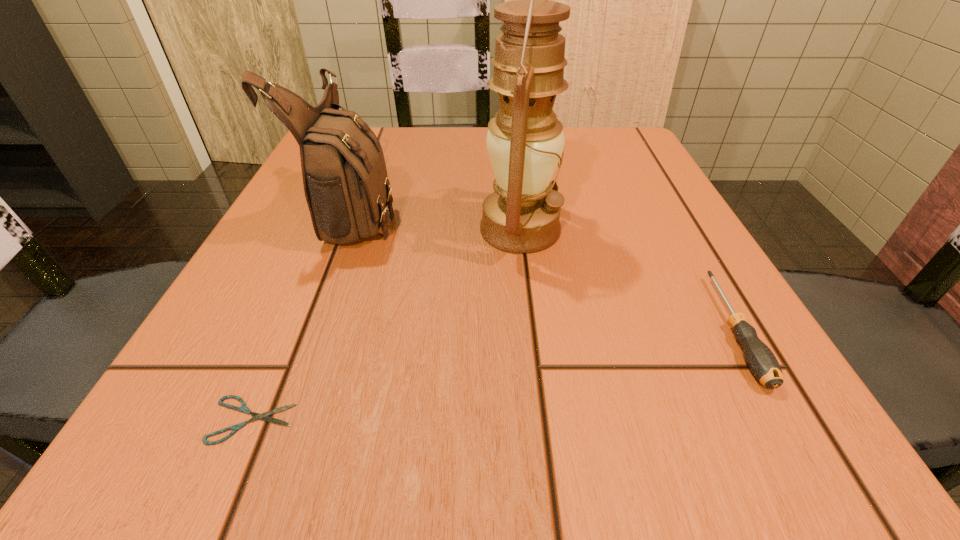
Image resolution: width=960 pixels, height=540 pixels. Find the location of `vacant area situated 0.210m on the back of the shortest object`. vacant area situated 0.210m on the back of the shortest object is located at coordinates (312, 277).

Find the location of `object present at the near edge`. object present at the near edge is located at coordinates (243, 408).

Locate an element on the screen. This screenshot has width=960, height=540. shoulder bag present at the left edge is located at coordinates (346, 186).

At what (x,y) coordinates should I click in order to perform the action: click on shears that is positioned at the left edge. Please return your answer as a coordinate pair (x, y). Looking at the image, I should click on (243, 408).

Locate an element on the screen. object situated at the right edge is located at coordinates (761, 361).

The width and height of the screenshot is (960, 540). What are the coordinates of `object at the near left corner` in the screenshot? It's located at 243,408.

Image resolution: width=960 pixels, height=540 pixels. Identify the location of free space at the far edge. (460, 142).

Image resolution: width=960 pixels, height=540 pixels. I want to click on blank space at the near edge of the desktop, so click(487, 402).

The height and width of the screenshot is (540, 960). In order to click on vacant space at the left edge of the desktop in this screenshot , I will do pyautogui.click(x=311, y=215).

This screenshot has width=960, height=540. Identify the location of free location at the right edge of the desktop. (657, 314).